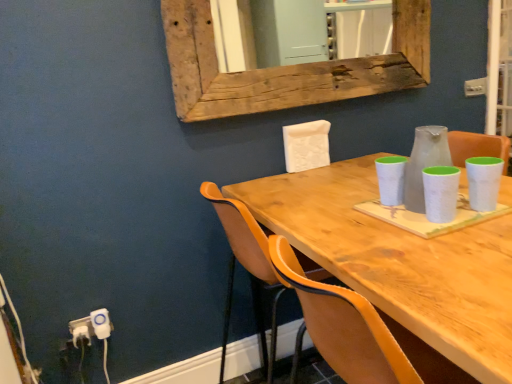
From the picture: Measure the distance between wooden table at center and camera.

They are 23.29 inches apart.

The height and width of the screenshot is (384, 512). Find the location of `white plastic electric outlet at lower left, which is counted as the 2th electric outlet, starting from the left`. white plastic electric outlet at lower left, which is counted as the 2th electric outlet, starting from the left is located at coordinates (101, 323).

Describe the element at coordinates (247, 270) in the screenshot. I see `orange leather chair at center` at that location.

Locate an element on the screen. orange leather chair at center is located at coordinates (247, 270).

What is the approximate height of white plastic electric outlet at lower left, which is the 2th electric outlet in right-to-left order?

The height of white plastic electric outlet at lower left, which is the 2th electric outlet in right-to-left order, is 3.76 inches.

Where is `wooden table at center`? The width and height of the screenshot is (512, 384). wooden table at center is located at coordinates (399, 261).

From the picture: From the image's perspective, is wooden table at center below weathered wood mirror at upper center?

Yes, from the image's perspective, wooden table at center is beneath weathered wood mirror at upper center.

Is wooden table at center looking in the opposite direction of weathered wood mirror at upper center?

No, wooden table at center's orientation is not away from weathered wood mirror at upper center.

Is wooden table at center to the right of weathered wood mirror at upper center from the viewer's perspective?

Indeed, wooden table at center is positioned on the right side of weathered wood mirror at upper center.

In the scene shown: Is weathered wood mirror at upper center inside the boundaries of orange leather chair at center, or outside?

weathered wood mirror at upper center exists outside the volume of orange leather chair at center.

From the picture: From a real-world perspective, which object stands above the other?

From a 3D spatial view, weathered wood mirror at upper center is above.

Which is less distant, (x=386, y=63) or (x=238, y=233)?

Positioned in front is point (x=238, y=233).

Is weathered wood mirror at upper center closer to the viewer compared to orange leather chair at center?

No.

Is orange leather chair at center positioned in front of weathered wood mirror at upper center?

Yes, it is.

In the scene shown: Who is smaller, orange leather chair at center or weathered wood mirror at upper center?

weathered wood mirror at upper center.

Is orange leather chair at center facing towards weathered wood mirror at upper center?

No, orange leather chair at center is not oriented towards weathered wood mirror at upper center.

Is white plastic electric outlet at lower left, arranged as the 1th electric outlet when viewed from the left, at the back of white plastic electric outlet at lower left, the 1th electric outlet viewed from the right?

Yes, white plastic electric outlet at lower left, the 1th electric outlet viewed from the right, is positioned with its back facing white plastic electric outlet at lower left, arranged as the 1th electric outlet when viewed from the left.

From a real-world perspective, which object stands above the other?

white plastic electric outlet at lower left, the 1th electric outlet viewed from the right.

Which is in front, white plastic electric outlet at lower left, which is counted as the 2th electric outlet, starting from the left, or white plastic electric outlet at lower left, arranged as the 1th electric outlet when viewed from the left?

white plastic electric outlet at lower left, which is counted as the 2th electric outlet, starting from the left, is closer to the camera.

Considering the positions of objects white plastic electric outlet at lower left, the 1th electric outlet viewed from the right, and white plastic electric outlet at lower left, arranged as the 1th electric outlet when viewed from the left, in the image provided, who is more to the right, white plastic electric outlet at lower left, the 1th electric outlet viewed from the right, or white plastic electric outlet at lower left, arranged as the 1th electric outlet when viewed from the left,?

From the viewer's perspective, white plastic electric outlet at lower left, the 1th electric outlet viewed from the right, appears more on the right side.

Which object is positioned more to the left, orange leather chair at center or white plastic electric outlet at lower left, which is counted as the 2th electric outlet, starting from the left?

Positioned to the left is white plastic electric outlet at lower left, which is counted as the 2th electric outlet, starting from the left.

Can you tell me how much orange leather chair at center and white plastic electric outlet at lower left, the 1th electric outlet viewed from the right, differ in facing direction?

orange leather chair at center and white plastic electric outlet at lower left, the 1th electric outlet viewed from the right, are facing 88.5 degrees away from each other.

Are orange leather chair at center and white plastic electric outlet at lower left, the 1th electric outlet viewed from the right, far apart?

No, there isn't a large distance between orange leather chair at center and white plastic electric outlet at lower left, the 1th electric outlet viewed from the right.

Looking at the image, does orange leather chair at center seem bigger or smaller compared to white plastic electric outlet at lower left, which is counted as the 2th electric outlet, starting from the left?

In the image, orange leather chair at center appears to be larger than white plastic electric outlet at lower left, which is counted as the 2th electric outlet, starting from the left.

From a real-world perspective, who is located lower, white plastic electric outlet at lower left, which is counted as the 2th electric outlet, starting from the left, or orange leather chair at center?

white plastic electric outlet at lower left, which is counted as the 2th electric outlet, starting from the left, from a real-world perspective.

Considering the points (98, 312) and (268, 381), which point is behind, point (98, 312) or point (268, 381)?

The point (268, 381) is farther.

Is white plastic electric outlet at lower left, which is counted as the 2th electric outlet, starting from the left, inside or outside of orange leather chair at center?

The correct answer is: outside.

Would you consider white plastic electric outlet at lower left, which is counted as the 2th electric outlet, starting from the left, to be distant from orange leather chair at center?

white plastic electric outlet at lower left, which is counted as the 2th electric outlet, starting from the left, is actually quite close to orange leather chair at center.

Considering the sizes of objects white plastic electric outlet at lower left, which is counted as the 2th electric outlet, starting from the left, and weathered wood mirror at upper center in the image provided, who is wider, white plastic electric outlet at lower left, which is counted as the 2th electric outlet, starting from the left, or weathered wood mirror at upper center?

weathered wood mirror at upper center is wider.

Are white plastic electric outlet at lower left, the 1th electric outlet viewed from the right, and weathered wood mirror at upper center located far from each other?

Yes, white plastic electric outlet at lower left, the 1th electric outlet viewed from the right, is far from weathered wood mirror at upper center.

Consider the image. From their relative heights in the image, would you say white plastic electric outlet at lower left, which is counted as the 2th electric outlet, starting from the left, is taller or shorter than weathered wood mirror at upper center?

Considering their sizes, white plastic electric outlet at lower left, which is counted as the 2th electric outlet, starting from the left, has less height than weathered wood mirror at upper center.

Where is `table lying on the right of weathered wood mirror at upper center`? The image size is (512, 384). table lying on the right of weathered wood mirror at upper center is located at coordinates (399, 261).

Where is `chair that is in front of the weathered wood mirror at upper center`? chair that is in front of the weathered wood mirror at upper center is located at coordinates (247, 270).

Considering their positions, is orange leather chair at center positioned further to wooden table at center than white plastic electric outlet at lower left, which is counted as the 2th electric outlet, starting from the left?

Among the two, white plastic electric outlet at lower left, which is counted as the 2th electric outlet, starting from the left, is located further to wooden table at center.

Looking at the image, which one is located closer to orange leather chair at center, weathered wood mirror at upper center or wooden table at center?

wooden table at center is closer to orange leather chair at center.

From the image, which object appears to be nearer to white plastic electric outlet at lower left, arranged as the 1th electric outlet when viewed from the left, orange leather chair at center or weathered wood mirror at upper center?

The object closer to white plastic electric outlet at lower left, arranged as the 1th electric outlet when viewed from the left, is orange leather chair at center.

Which object lies nearer to the anchor point wooden table at center, white plastic electric outlet at lower left, which is the 2th electric outlet in right-to-left order, or weathered wood mirror at upper center?

The object closer to wooden table at center is weathered wood mirror at upper center.

Considering their positions, is orange leather chair at center positioned further to weathered wood mirror at upper center than white plastic electric outlet at lower left, arranged as the 1th electric outlet when viewed from the left?

Based on the image, white plastic electric outlet at lower left, arranged as the 1th electric outlet when viewed from the left, appears to be further to weathered wood mirror at upper center.

Estimate the real-world distances between objects in this image. Which object is closer to wooden table at center, white plastic electric outlet at lower left, which is counted as the 2th electric outlet, starting from the left, or white plastic electric outlet at lower left, arranged as the 1th electric outlet when viewed from the left?

white plastic electric outlet at lower left, arranged as the 1th electric outlet when viewed from the left, is closer to wooden table at center.

Looking at this image, considering their positions, is wooden table at center positioned further to white plastic electric outlet at lower left, which is counted as the 2th electric outlet, starting from the left, than orange leather chair at center?

wooden table at center.

Considering their positions, is white plastic electric outlet at lower left, which is the 2th electric outlet in right-to-left order, positioned closer to orange leather chair at center than weathered wood mirror at upper center?

weathered wood mirror at upper center is closer to orange leather chair at center.

Locate an element on the screen. This screenshot has width=512, height=384. electric outlet between weathered wood mirror at upper center and white plastic electric outlet at lower left, arranged as the 1th electric outlet when viewed from the left, vertically is located at coordinates (101, 323).

Locate an element on the screen. The width and height of the screenshot is (512, 384). chair between weathered wood mirror at upper center and white plastic electric outlet at lower left, which is the 2th electric outlet in right-to-left order, from top to bottom is located at coordinates (247, 270).

Locate an element on the screen. chair that lies between weathered wood mirror at upper center and white plastic electric outlet at lower left, which is counted as the 2th electric outlet, starting from the left, from top to bottom is located at coordinates [247, 270].

This screenshot has height=384, width=512. Find the location of `chair between white plastic electric outlet at lower left, arranged as the 1th electric outlet when viewed from the left, and wooden table at center, in the horizontal direction`. chair between white plastic electric outlet at lower left, arranged as the 1th electric outlet when viewed from the left, and wooden table at center, in the horizontal direction is located at coordinates (247, 270).